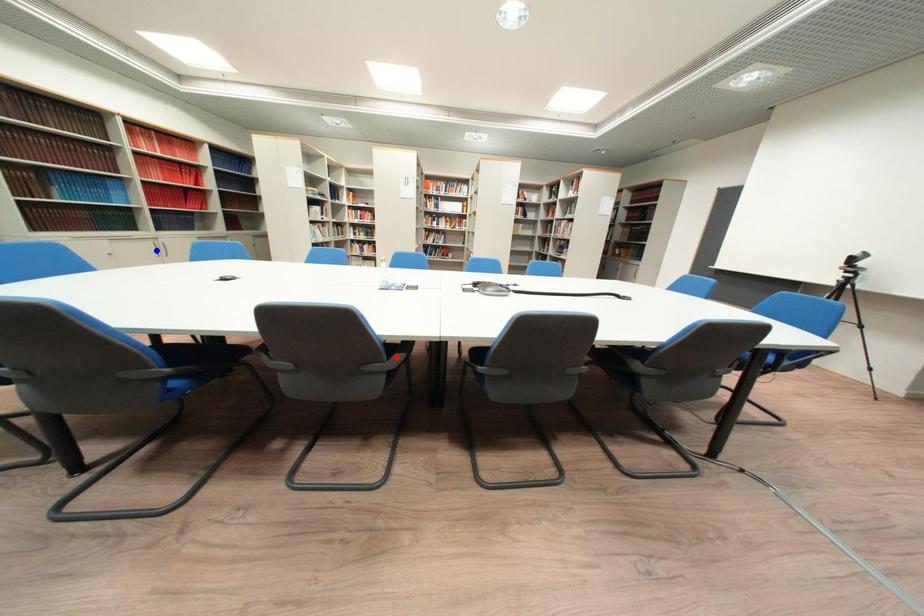
Question: Which of the two points in the image is closer to the camera?

Choices:
 (A) Blue point is closer.
 (B) Red point is closer.

Answer: (B)